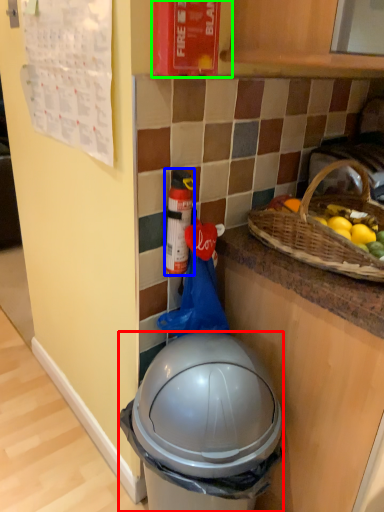
Question: Which is nearer to the trash bin/can (highlighted by a red box)? bottle (highlighted by a blue box) or fire extinguisher (highlighted by a green box).

Choices:
 (A) bottle
 (B) fire extinguisher

Answer: (A)